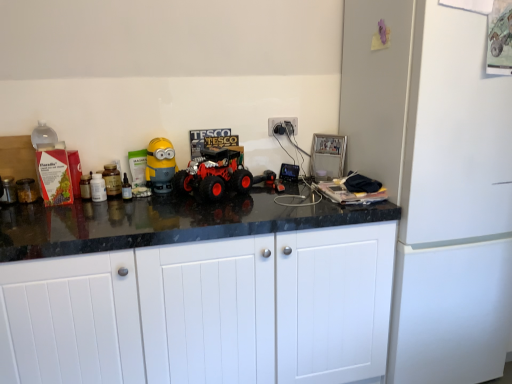
Question: Looking at the image, does rubberized black toy truck at center, which is counted as the 1th toy, starting from the right, seem bigger or smaller compared to white matte cabinet doors at center?

Choices:
 (A) small
 (B) big

Answer: (A)

Question: Which is correct: rubberized black toy truck at center, which is counted as the 1th toy, starting from the right, is inside white matte cabinet doors at center, or outside of it?

Choices:
 (A) inside
 (B) outside

Answer: (A)

Question: Estimate the real-world distances between objects in this image. Which object is farther from the white matte cabinet doors at center?

Choices:
 (A) white plastic electric outlet at upper right
 (B) rubberized red toy truck at center
 (C) yellow matte toy at center, the second toy positioned from the right
 (D) translucent plastic bottle at center
 (E) white matte refrigerator at right

Answer: (A)

Question: Estimate the real-world distances between objects in this image. Which object is farther from the rubberized red toy truck at center?

Choices:
 (A) white matte refrigerator at right
 (B) rubberized black toy truck at center, which ranks as the second toy in left-to-right order
 (C) white matte cabinet doors at center
 (D) translucent plastic bottle at center
 (E) yellow matte toy at center, the second toy positioned from the right

Answer: (A)